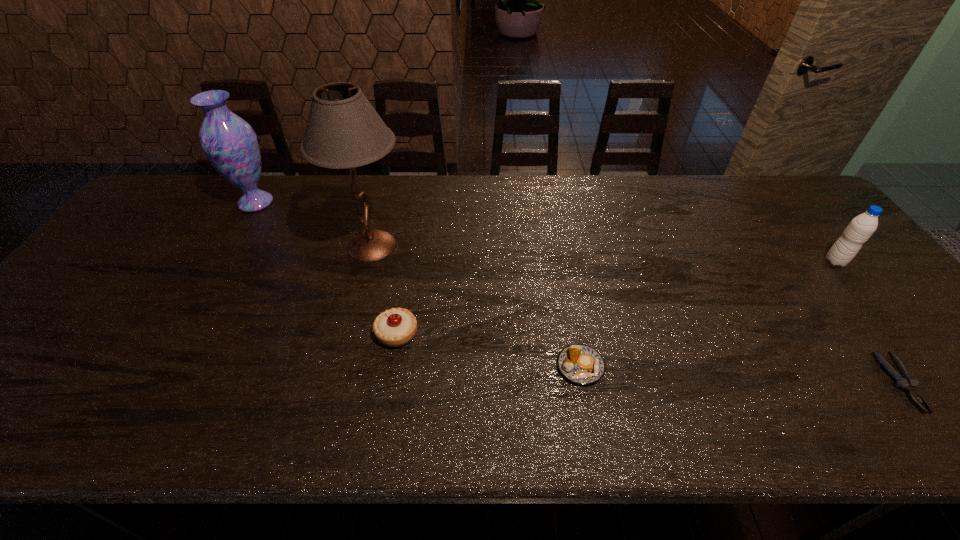
Locate an element on the screen. This screenshot has width=960, height=540. the shortest object is located at coordinates (907, 382).

This screenshot has height=540, width=960. Find the location of `free space located on the front-facing side of the table lamp`. free space located on the front-facing side of the table lamp is located at coordinates (512, 246).

Where is `vacant point located on the front of the second tallest object`? vacant point located on the front of the second tallest object is located at coordinates (222, 260).

Locate an element on the screen. blank area located on the back of the water bottle is located at coordinates (815, 237).

Where is `free space located on the front of the taller pastry`? This screenshot has width=960, height=540. free space located on the front of the taller pastry is located at coordinates (383, 421).

Where is `free region located 0.050m on the back of the shorter pastry`? free region located 0.050m on the back of the shorter pastry is located at coordinates (574, 330).

Image resolution: width=960 pixels, height=540 pixels. In order to click on object at the far edge in this screenshot , I will do `click(230, 144)`.

You are a GUI agent. You are given a task and a screenshot of the screen. Output one action in this format:
    pyautogui.click(x=<x>, y=<y>)
    Task: Click on the object that is at the near edge
    
    Given the screenshot: What is the action you would take?
    pyautogui.click(x=907, y=382)

The height and width of the screenshot is (540, 960). What are the coordinates of `water bottle at the right edge` in the screenshot? It's located at (860, 229).

The image size is (960, 540). What are the coordinates of `pliers present at the right edge` in the screenshot? It's located at [x=907, y=382].